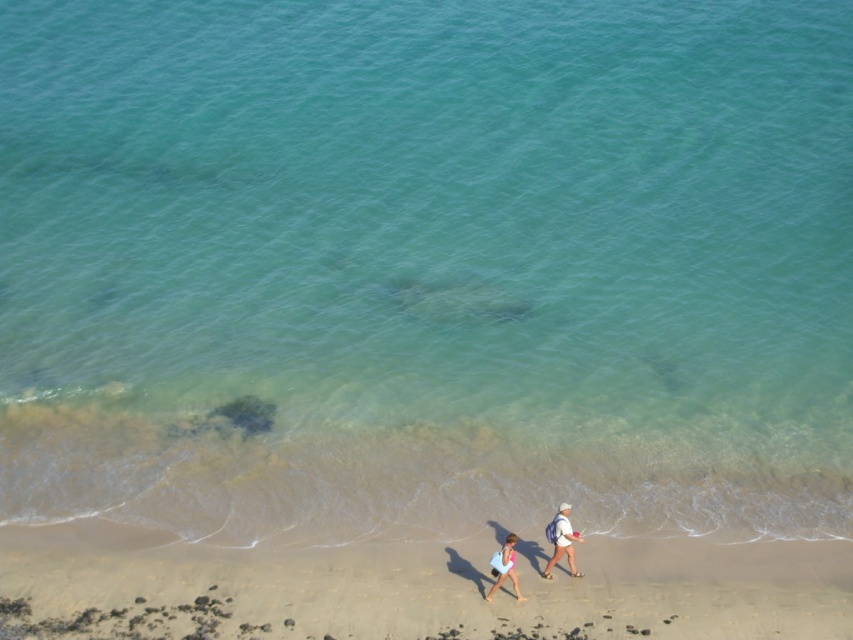
Question: Which point is closer to the camera?

Choices:
 (A) white fabric backpack at lower center
 (B) white cotton shirt at lower center

Answer: (B)

Question: From the image, what is the correct spatial relationship of fine-grained sand at lower center in relation to white cotton shirt at lower center?

Choices:
 (A) left
 (B) right

Answer: (A)

Question: Can you confirm if white fabric backpack at lower center is smaller than light pink fabric dress at lower center?

Choices:
 (A) no
 (B) yes

Answer: (A)

Question: Which point is closer to the camera?

Choices:
 (A) (192, 552)
 (B) (497, 584)
 (C) (578, 538)
 (D) (496, 582)

Answer: (B)

Question: Which point is closer to the camera?

Choices:
 (A) (554, 529)
 (B) (509, 534)
 (C) (503, 556)

Answer: (C)

Question: Is fine-grained sand at lower center to the right of light pink fabric dress at lower center from the viewer's perspective?

Choices:
 (A) yes
 (B) no

Answer: (B)